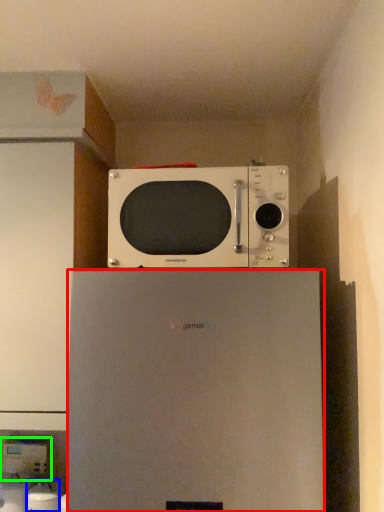
Question: Which is nearer to the refrigerator (highlighted by a red box)? appliance (highlighted by a blue box) or appliance (highlighted by a green box).

Choices:
 (A) appliance
 (B) appliance

Answer: (A)